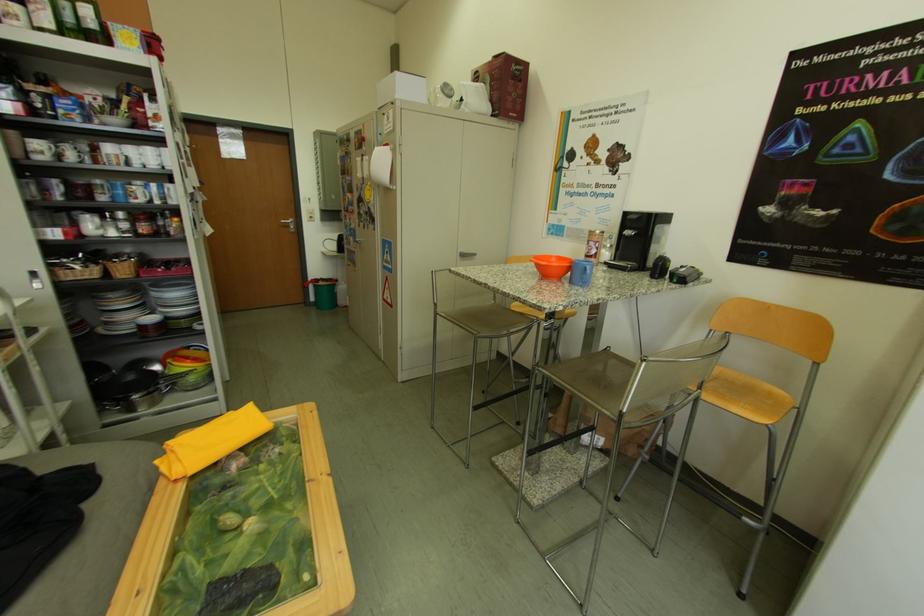
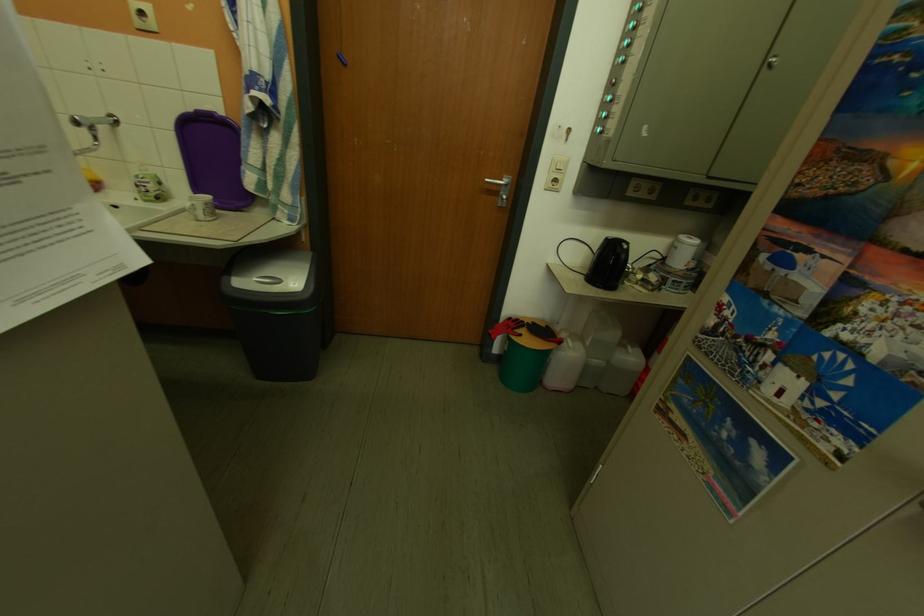
Find the pixel in the second image that matches [349,284] in the first image.

(574, 345)